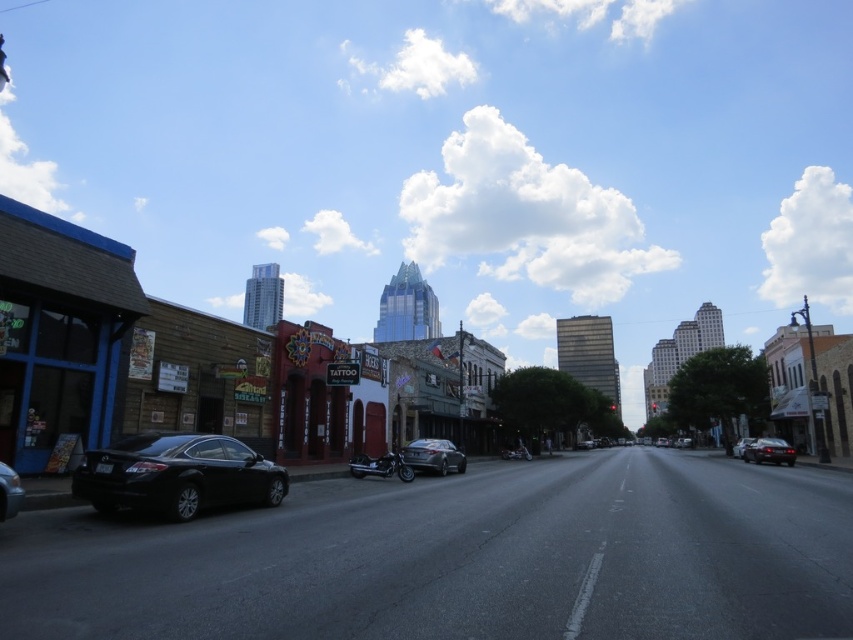
You are a delivery driver who needs to park your truck between the satin silver sedan at center and the black matte sedan at center. Can you fit your truck that is 2.5 meters wide in the space between them?

The satin silver sedan at center is thinner than the black matte sedan at center, but the exact width of the space between them isn not provided. Without knowing the distance between the two sedans, it is impossible to determine if the truck can fit.

You are a delivery driver who needs to park your 1.8 meters tall delivery box on the street. You see the satin silver sedan at center and the black matte sedan at center. Which sedan can you place the delivery box next to without it being taller than the sedan?

The satin silver sedan at center has a greater height compared to black matte sedan at center, so you can place the delivery box next to the satin silver sedan at center since it is taller than the black matte sedan at center.

You are a pedestrian standing on the sidewalk next to the black matte car at left and the black matte sedan at center. You want to cross the street to the store on the other side. Which vehicle should you step over first?

The black matte car at left is positioned over the black matte sedan at center, so you should step over the black matte car at left first.